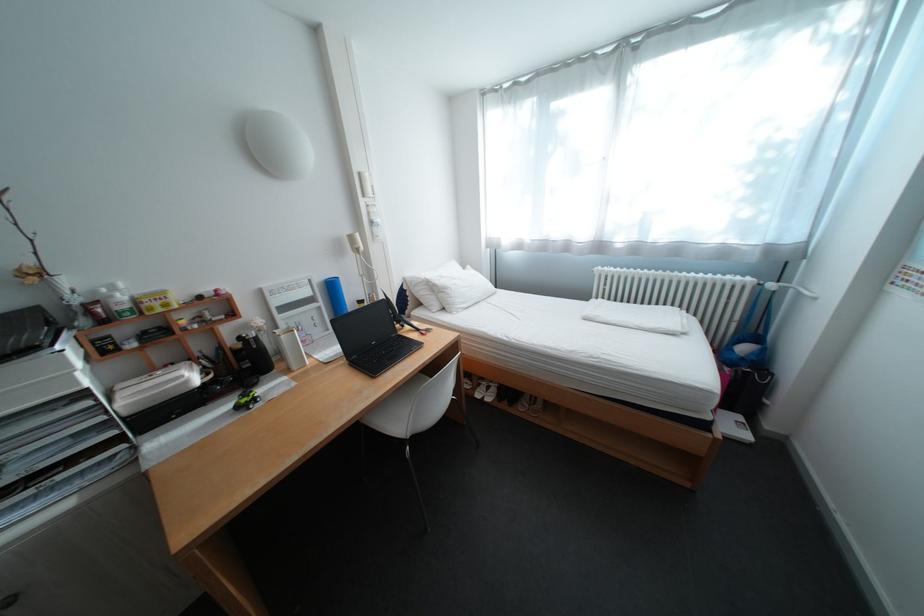
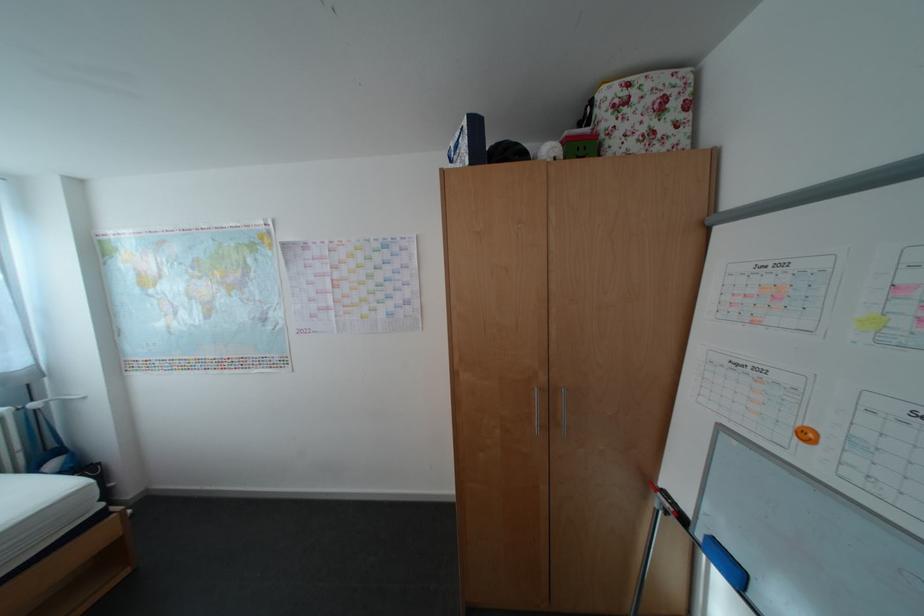
The point at (773, 333) is marked in the first image. Where is the corresponding point in the second image?

(67, 447)